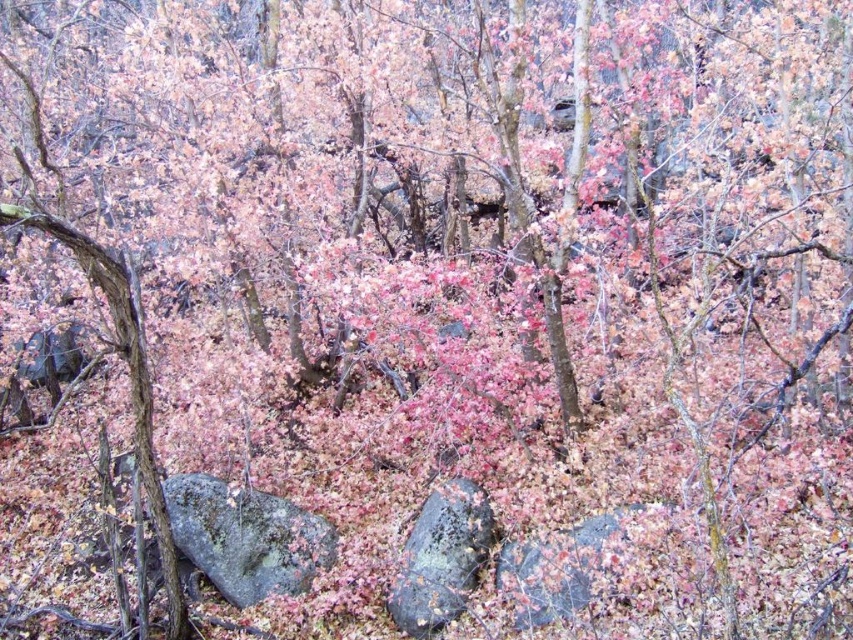
You are standing at the camera position in the forest scene. There is a gray rough rock at lower left. Can you reach it without moving more than 30 feet? Please explain your reasoning.

The gray rough rock at lower left is 29.51 feet away from the camera position. Since 29.51 feet is less than 30 feet, you can reach it without moving more than 30 feet.